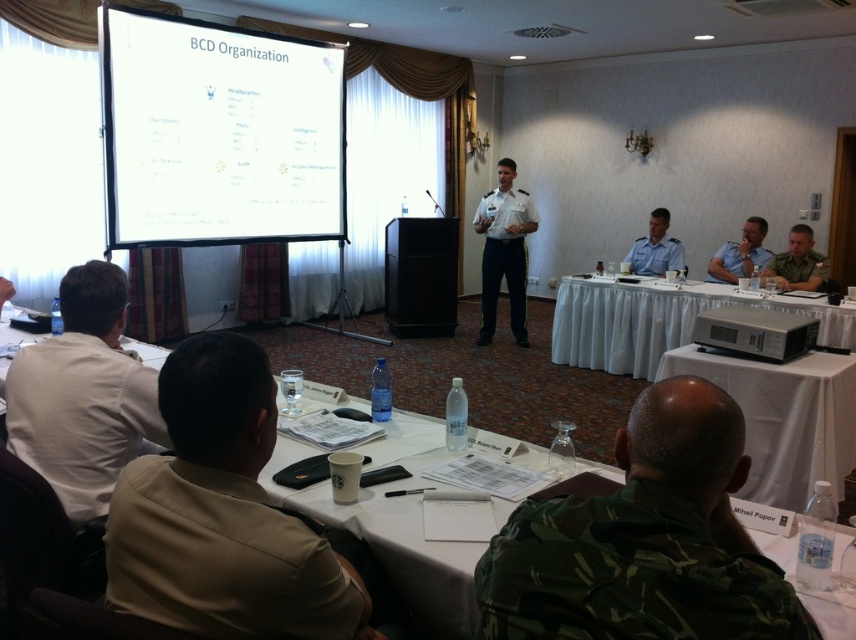
You are a photographer in the back of the room. You need to take a photo of both the camouflage uniform at right and the matte blue uniform at center. Can you fit both subjects in the frame if your camera has a 10 inch wide field of view?

The camouflage uniform at right and matte blue uniform at center are 11.56 inches apart, which is wider than the camera field of view of 10 inches. Therefore, you cannot fit both subjects in the frame.

You are standing in the conference room and want to take a photo of the point at coordinates (675, 452). Is the point within your camera frame if the camera has a 4.0 feet focal length?

The point at coordinates (675, 452) is 3.30 feet from the camera, which is within the camera frame since the focal length is 4.0 feet.

You are a photographer positioned at the back of the room. You need to capture a photo of both the camouflage uniform at right and the matte blue uniform at center without any obstruction. Can you take the photo as you are now?

The camouflage uniform at right is in front of the matte blue uniform at center, so taking a photo from your current position at the back may result in the camouflage uniform at right blocking the matte blue uniform at center. You might need to adjust your angle or move to ensure both are visible without obstruction.